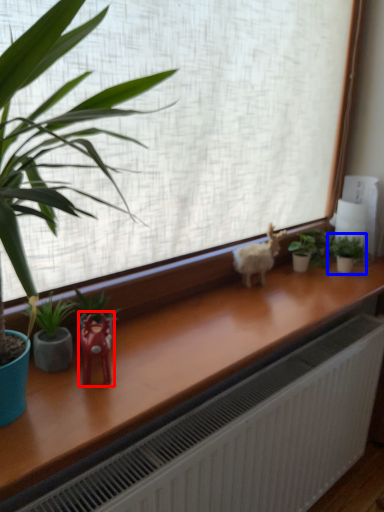
Question: Which of the following is the closest to the observer, miniature (highlighted by a red box) or houseplant (highlighted by a blue box)?

Choices:
 (A) miniature
 (B) houseplant

Answer: (A)